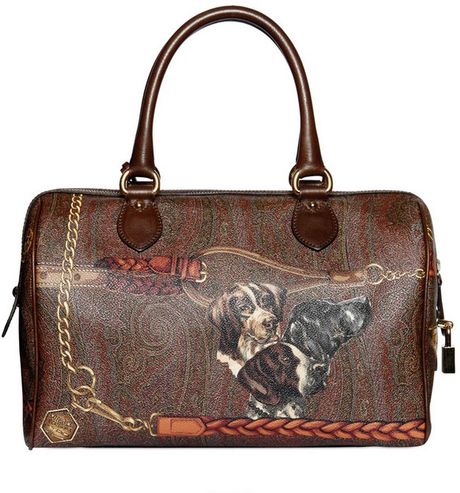
Find the location of `empty space to the left of the purse`. empty space to the left of the purse is located at coordinates (12, 245).